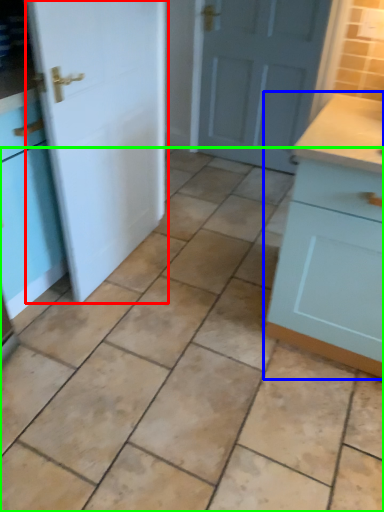
Question: Which object is positioned farthest from door (highlighted by a red box)? Select from cabinetry (highlighted by a blue box) and ceramic tile (highlighted by a green box).

Choices:
 (A) cabinetry
 (B) ceramic tile

Answer: (A)